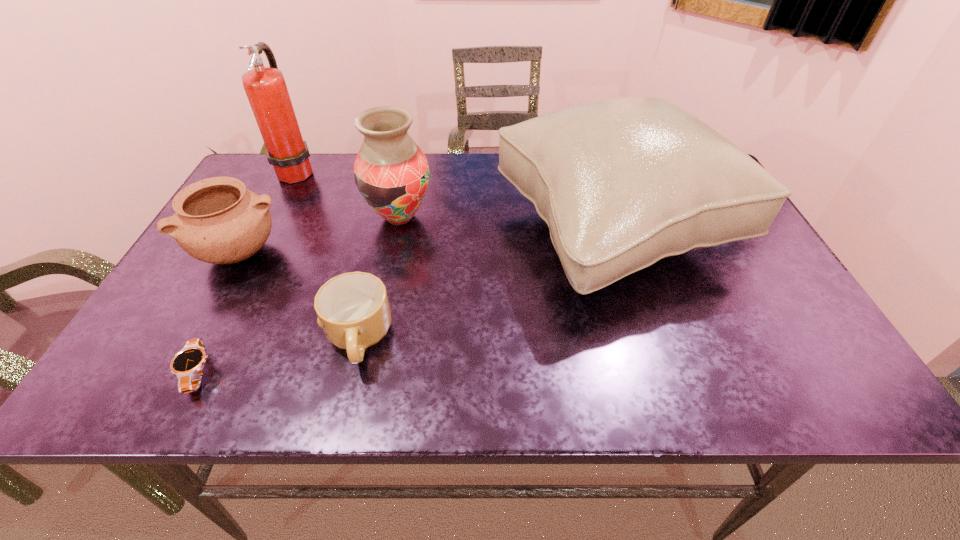
The height and width of the screenshot is (540, 960). What are the coordinates of `free point that satisfies the following two spatial constraints: 1. at the nozzle of the fire extinguisher; 2. on the right side of the rightmost object` in the screenshot? It's located at (267, 230).

At what (x,y) coordinates should I click in order to perform the action: click on blank area in the image that satisfies the following two spatial constraints: 1. at the nozzle of the fire extinguisher; 2. on the back side of the vase. Please return your answer as a coordinate pair (x, y). This screenshot has width=960, height=540. Looking at the image, I should click on (273, 217).